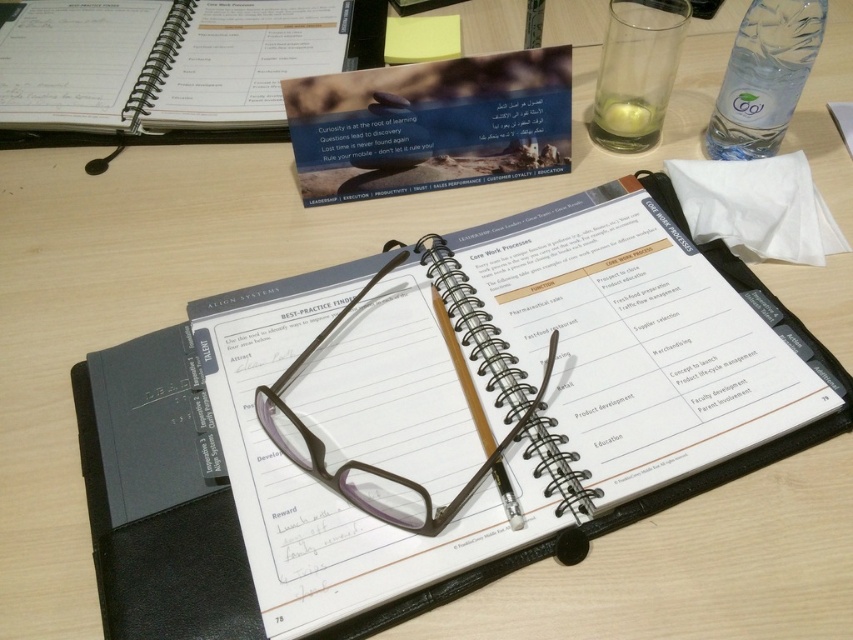
Which is below, white paper at upper right or brown plastic glasses at center?

brown plastic glasses at center

Does white paper at upper right come in front of brown plastic glasses at center?

That is False.

Between point (796, 202) and point (287, 438), which one is positioned in front?

Point (287, 438)

The image size is (853, 640). I want to click on white paper at upper right, so click(x=757, y=208).

Does black spiral notebook at center have a lesser width compared to spiral-bound paper at center?

Incorrect, black spiral notebook at center's width is not less than spiral-bound paper at center's.

Does black spiral notebook at center have a larger size compared to spiral-bound paper at center?

Yes, black spiral notebook at center is bigger than spiral-bound paper at center.

Which is behind, point (119, 580) or point (306, 49)?

The point (306, 49) is behind.

The height and width of the screenshot is (640, 853). I want to click on black spiral notebook at center, so click(438, 419).

Is the position of black spiral notebook at center less distant than that of clear plastic bottle at upper right?

Yes, black spiral notebook at center is closer to the viewer.

Which is more to the left, black spiral notebook at center or clear plastic bottle at upper right?

black spiral notebook at center

Locate an element on the screen. black spiral notebook at center is located at coordinates (438, 419).